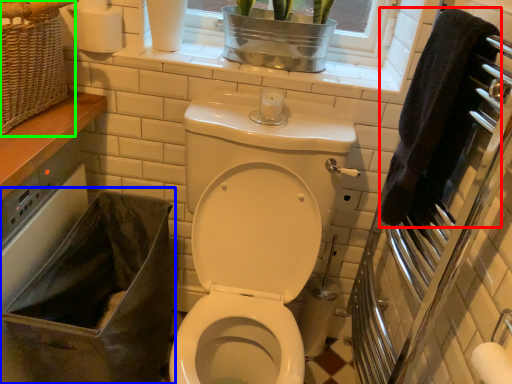
Question: Which object is the farthest from hand towel (highlighted by a red box)? Choose among these: laundry basket (highlighted by a blue box) or basket (highlighted by a green box).

Choices:
 (A) laundry basket
 (B) basket

Answer: (B)